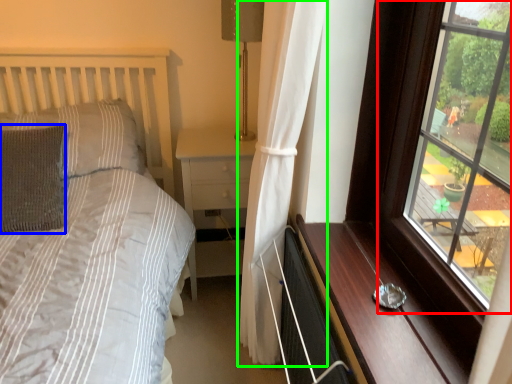
Question: Which is nearer to the window (highlighted by a red box)? pillow (highlighted by a blue box) or curtain (highlighted by a green box).

Choices:
 (A) pillow
 (B) curtain

Answer: (B)